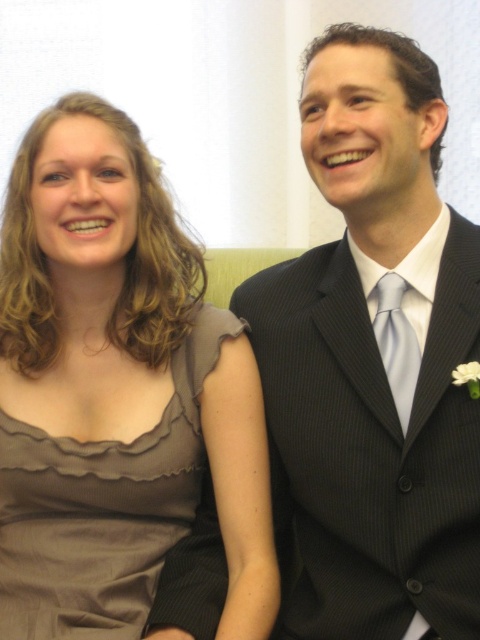
Does satin dress at left have a larger size compared to light blue silk tie at center?

Yes.

Is satin dress at left wider than light blue silk tie at center?

Indeed, satin dress at left has a greater width compared to light blue silk tie at center.

In order to click on satin dress at left in this screenshot , I will do pos(101,509).

In order to click on satin dress at left in this screenshot , I will do `click(101, 509)`.